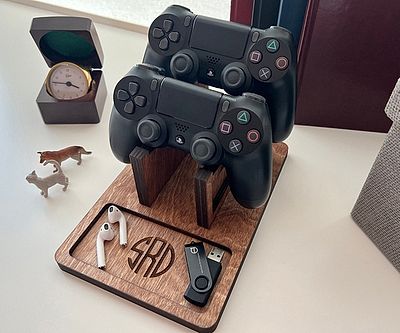
In order to click on black playstation controller in this screenshot , I will do `click(185, 115)`, `click(226, 51)`.